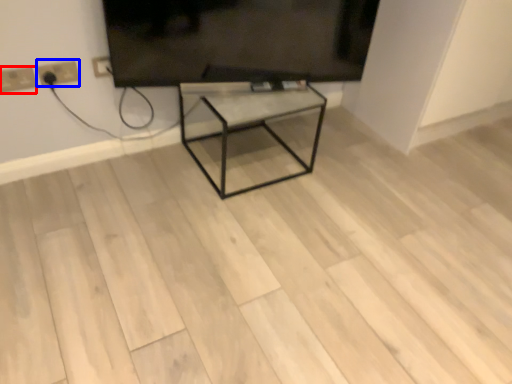
Question: Among these objects, which one is nearest to the camera, electric outlet (highlighted by a red box) or electric outlet (highlighted by a blue box)?

Choices:
 (A) electric outlet
 (B) electric outlet

Answer: (A)